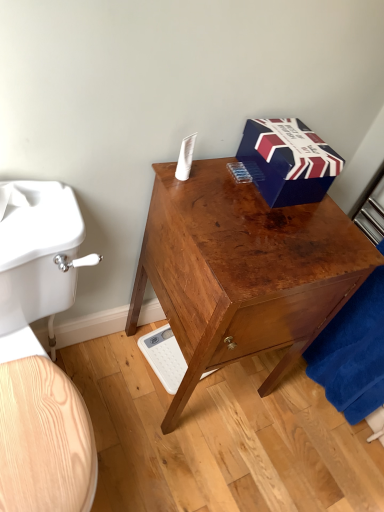
Find the location of a particular element. vacant space situated on the left part of velvety blue towel at lower right is located at coordinates (269, 391).